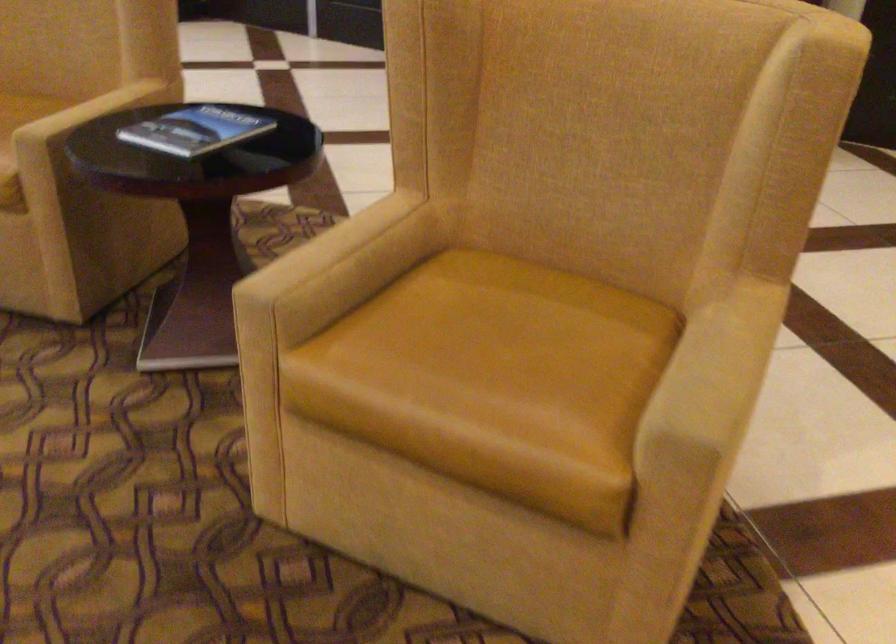
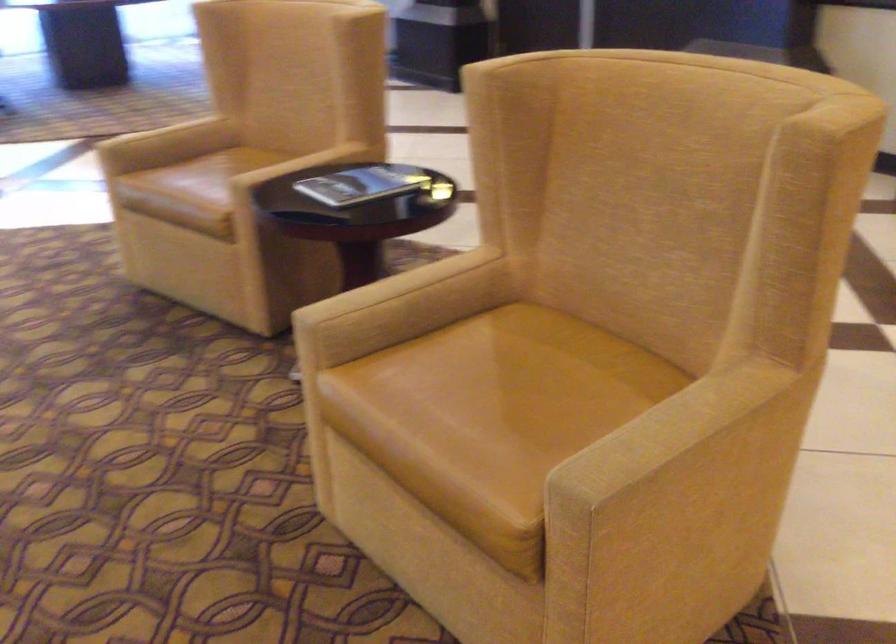
In the second image, find the point that corresponds to the point at 503,353 in the first image.

(500, 398)